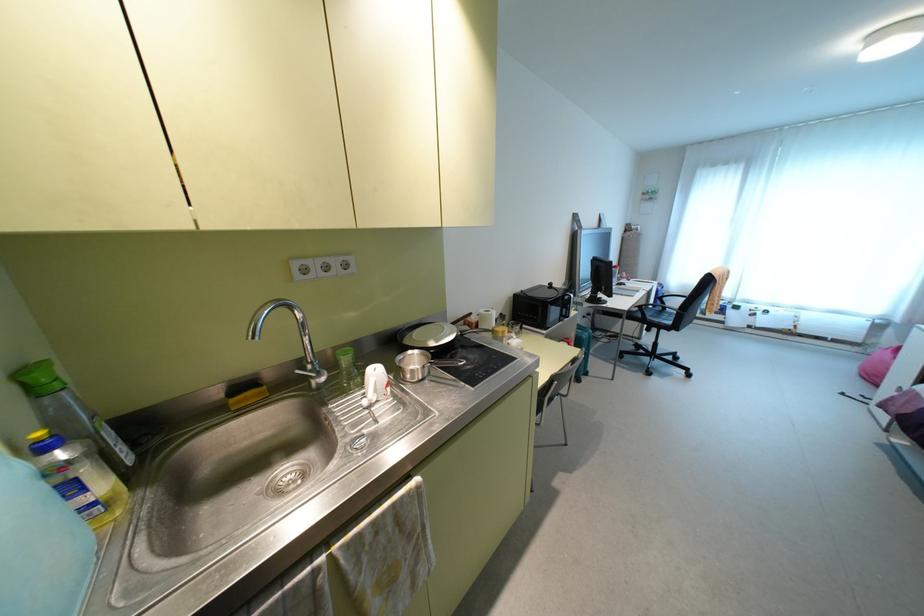
Where is `green top bottle`? The image size is (924, 616). green top bottle is located at coordinates (70, 413).